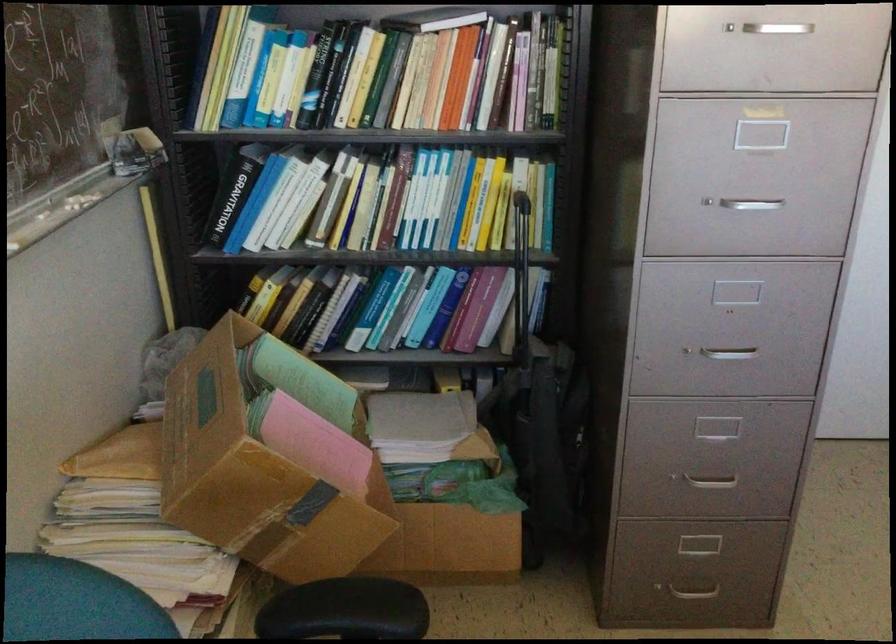
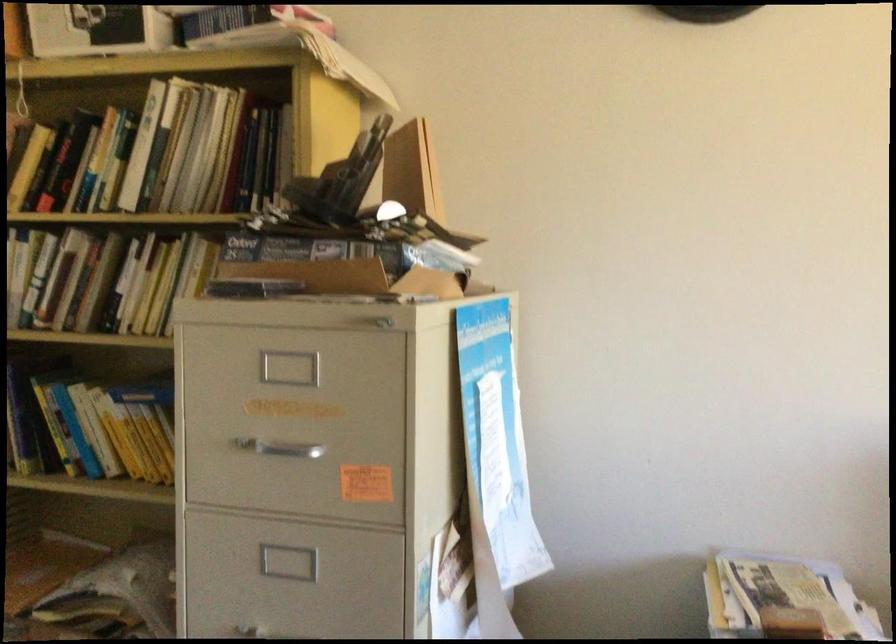
Question: The camera is either moving clockwise (left) or counter-clockwise (right) around the object. The first image is from the beginning of the video and the second image is from the end. Is the camera moving left or right when shooting the video?

Choices:
 (A) Left
 (B) Right

Answer: (A)